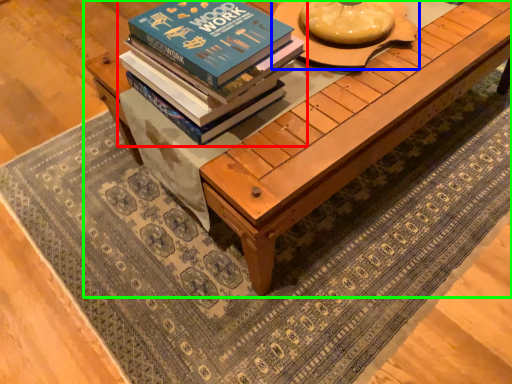
Question: Which is farther away from book (highlighted by a red box)? round table (highlighted by a blue box) or table (highlighted by a green box)?

Choices:
 (A) round table
 (B) table

Answer: (A)